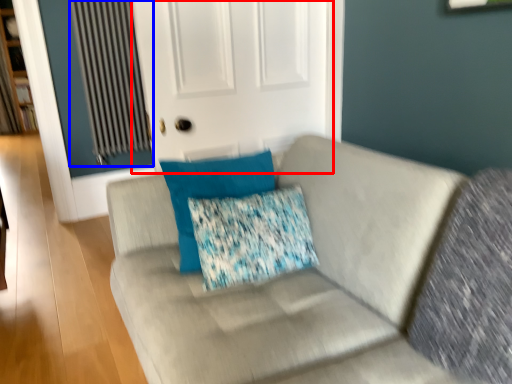
Question: Which point is closer to the camera, screen door (highlighted by a red box) or radiator (highlighted by a blue box)?

Choices:
 (A) screen door
 (B) radiator

Answer: (A)